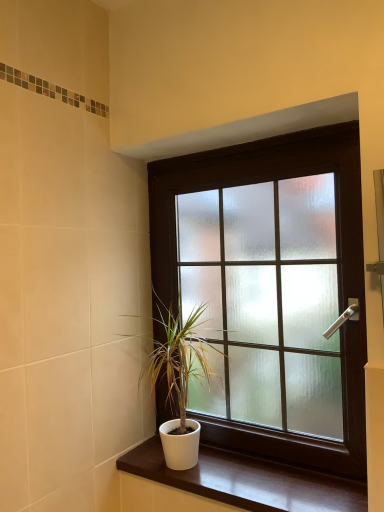
You are a GUI agent. You are given a task and a screenshot of the screen. Output one action in this format:
    pyautogui.click(x=<x>, y=<y>)
    Task: Click on the vacant region under white matte pot at lower center (from a real-world perspective)
    
    Given the screenshot: What is the action you would take?
    pyautogui.click(x=176, y=465)